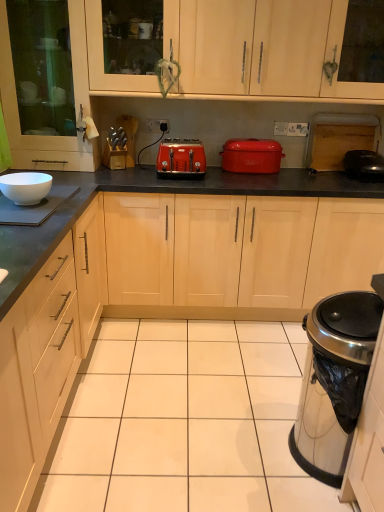
Question: Considering the relative positions of orange matte toaster at center and white glossy bowl at left, the 2th appliance positioned from the back, in the image provided, is orange matte toaster at center to the left or to the right of white glossy bowl at left, the 2th appliance positioned from the back,?

Choices:
 (A) right
 (B) left

Answer: (A)

Question: Is orange matte toaster at center spatially inside white glossy bowl at left, arranged as the 2th appliance when viewed from the front, or outside of it?

Choices:
 (A) outside
 (B) inside

Answer: (A)

Question: Which object is positioned closest to the black glossy pan at right, placed as the first appliance when sorted from top to bottom?

Choices:
 (A) light wood cabinet at upper center, which is counted as the 1th cabinetry, starting from the right
 (B) satin silver trash can at lower right, the third appliance in the back-to-front sequence
 (C) white plastic electric outlet at center
 (D) matte ceramic crockery at center
 (E) orange matte toaster at center

Answer: (D)

Question: Considering the real-world distances, which object is closest to the matte ceramic crockery at center?

Choices:
 (A) satin silver trash can at lower right, the 3th appliance in the top-to-bottom sequence
 (B) white glossy bowl at left, arranged as the 2th appliance when viewed from the front
 (C) white plastic electric outlet at center
 (D) white matte bowl at left
 (E) light wood cabinet at upper center, which is counted as the 1th cabinetry, starting from the right

Answer: (E)